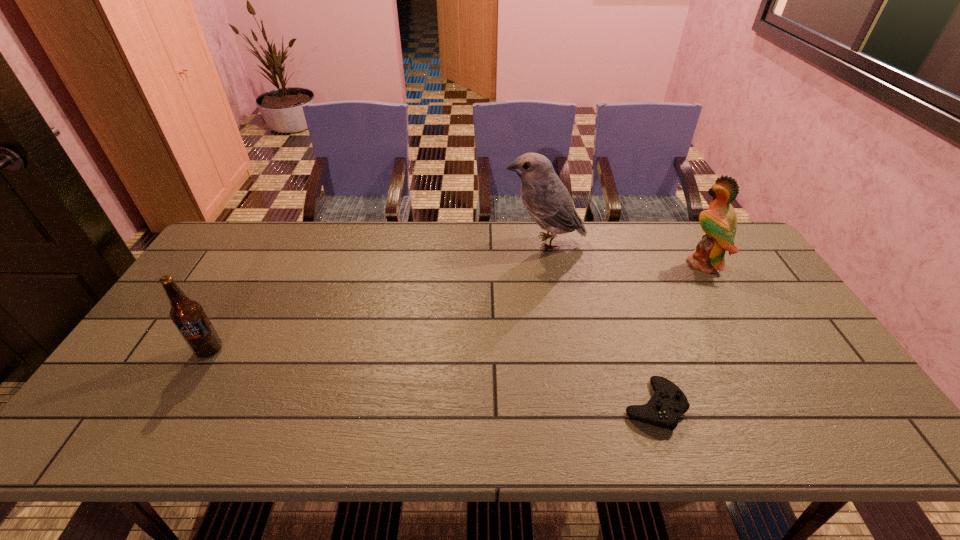
The image size is (960, 540). In the image, there is a desktop. What are the coordinates of `vacant space at the left edge` in the screenshot? It's located at (125, 391).

I want to click on free spot at the right edge of the desktop, so click(736, 302).

Find the location of `vacant space at the far left corner of the desktop`. vacant space at the far left corner of the desktop is located at coordinates (258, 232).

Identify the location of vacant space at the far right corner. Image resolution: width=960 pixels, height=540 pixels. (700, 233).

Identify the location of free region at the near right corner of the desktop. (861, 440).

This screenshot has height=540, width=960. Identify the location of blank region between the third farthest object and the rightmost object. (456, 307).

Identify the location of empty location between the left parrot and the shortest object. (599, 323).

This screenshot has height=540, width=960. In order to click on blank region between the left parrot and the leftmost object in this screenshot , I will do `click(376, 296)`.

Find the location of a particular element. free point between the nearest object and the left parrot is located at coordinates (599, 323).

At what (x,y) coordinates should I click in order to perform the action: click on vacant space that is in between the beer bottle and the left parrot. Please return your answer as a coordinate pair (x, y). Looking at the image, I should click on (376, 296).